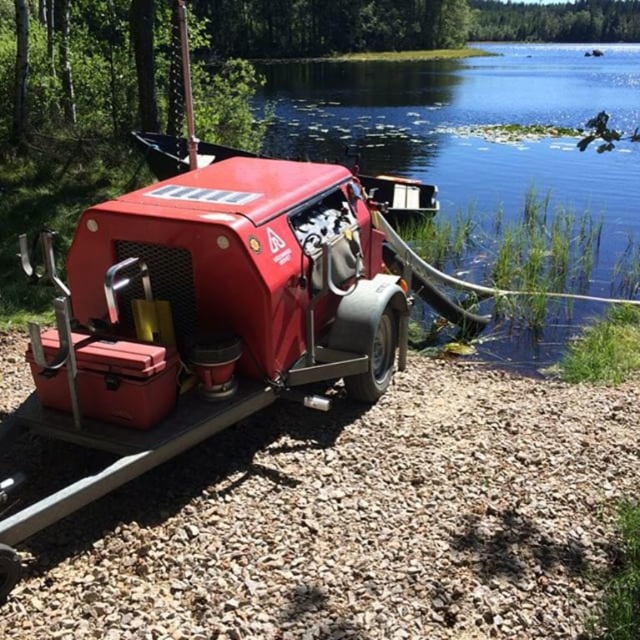
You are standing at the edge of the gravel shore and want to reach the clear water at lower right. Which direction should you move relative to the smooth gravel shore at lower right?

To reach the clear water at lower right from the smooth gravel shore at lower right, you should move to the right since the clear water is located to the right of the smooth gravel shore at lower right.

You are standing at the point labeled as point (x=356, y=144) and want to walk towards the point labeled as point (x=426, y=465). Which direction should you move relative to the trailer?

You should move forward towards the point (x=426, y=465) because it is in front of point (x=356, y=144) relative to the trailer.

In the scene shown: You are a delivery person who needs to transport a heavy crate weighing 200 kg from the smooth gravel shore at lower right to the clear water at lower right. The path between them is 10.67 meters. Can you safely move the crate across this distance without damaging the shore or the crate?

The distance between the smooth gravel shore at lower right and the clear water at lower right is 10.67 meters. Since the gravel shore is smooth, it should be able to support the weight of the 200 kg crate. However, you should ensure the path is clear of obstacles and use proper equipment to move the crate safely over the 10.67 meters distance.